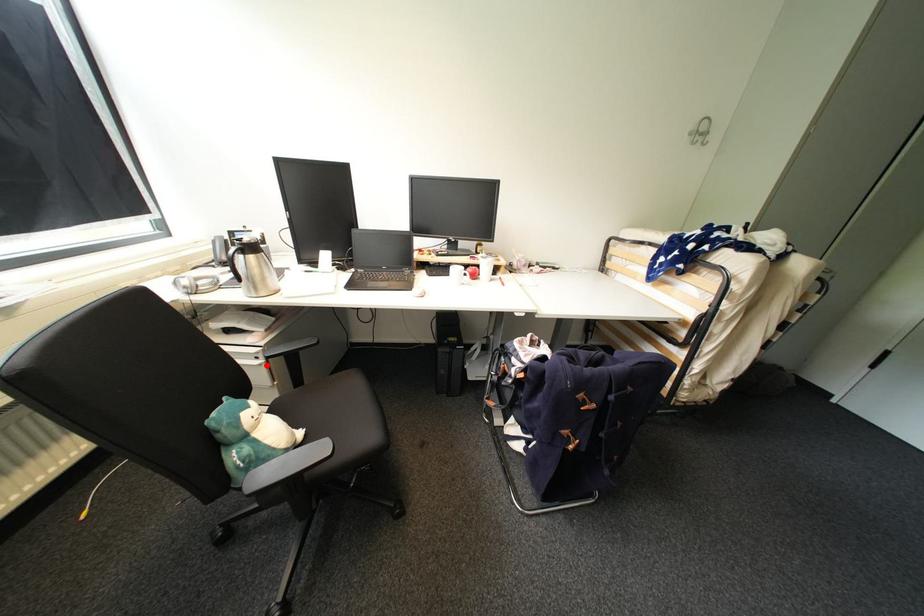
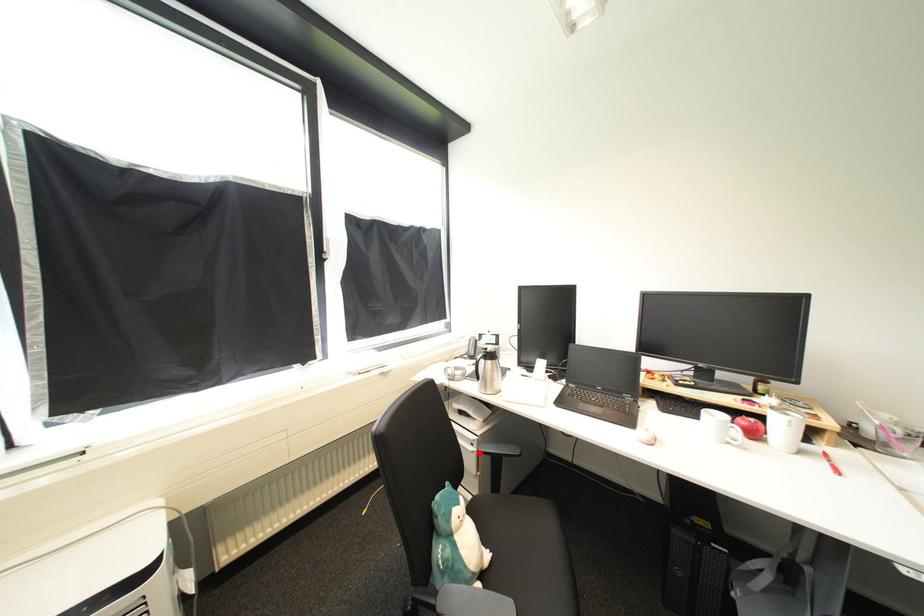
I am providing you with two images of the same scene from different viewpoints. A red point is marked on the first image and another point is marked on the second image. Is the marked point in image1 the same physical position as the marked point in image2?

Yes